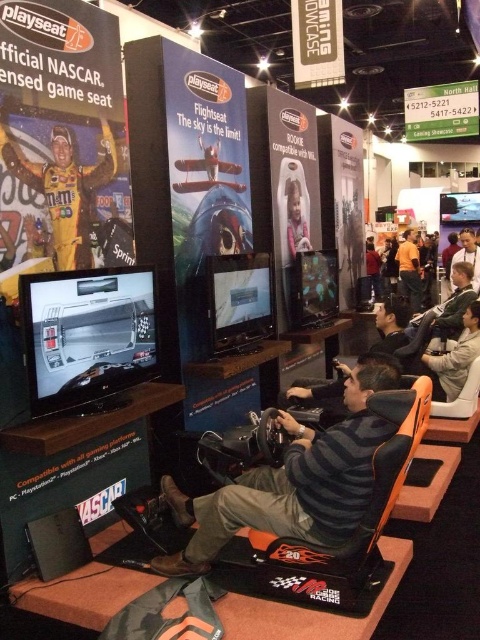
Who is more distant from viewer, (360,369) or (38,192)?

The point (38,192) is more distant.

From the picture: Between orange fabric racing seat at center and matte yellow racing suit at upper left, which one is positioned lower?

orange fabric racing seat at center

Locate an element on the screen. The height and width of the screenshot is (640, 480). orange fabric racing seat at center is located at coordinates (292, 483).

I want to click on orange fabric racing seat at center, so click(x=292, y=483).

Can you confirm if orange fabric racing seat at center is positioned to the left of matte black racing seat at center?

Correct, you'll find orange fabric racing seat at center to the left of matte black racing seat at center.

Image resolution: width=480 pixels, height=640 pixels. I want to click on orange fabric racing seat at center, so click(292, 483).

Does matte yellow racing suit at upper left have a greater height compared to matte black racing seat at center?

Indeed, matte yellow racing suit at upper left has a greater height compared to matte black racing seat at center.

In the scene shown: Does matte yellow racing suit at upper left appear under matte black racing seat at center?

No.

Who is more distant from viewer, (x=84, y=205) or (x=478, y=308)?

Positioned behind is point (x=478, y=308).

Image resolution: width=480 pixels, height=640 pixels. In order to click on matte yellow racing suit at upper left in this screenshot , I will do `click(63, 189)`.